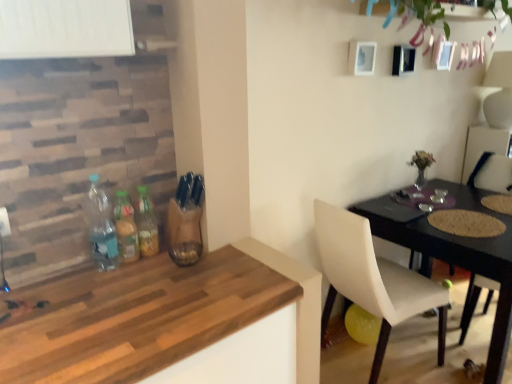
Where is `free space in front of translucent glass bottles at center, the third bottle viewed from the left`? free space in front of translucent glass bottles at center, the third bottle viewed from the left is located at coordinates (128, 270).